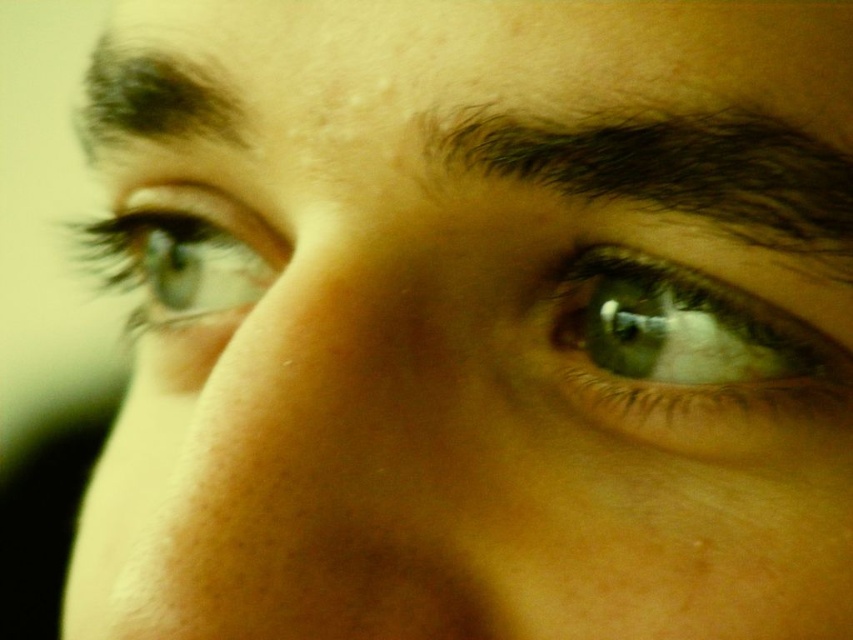
Question: Among these objects, which one is farthest from the camera?

Choices:
 (A) green matte eye at upper left
 (B) dark brown hair at upper left
 (C) dark brown hair at upper center

Answer: (A)

Question: Among these objects, which one is farthest from the camera?

Choices:
 (A) green matte eye at upper left
 (B) green matte eye at center
 (C) dark brown hair at upper center

Answer: (A)

Question: Is green matte eye at center positioned at the back of green matte eye at upper left?

Choices:
 (A) no
 (B) yes

Answer: (A)

Question: Can you confirm if green matte eye at center is bigger than green matte eye at upper left?

Choices:
 (A) yes
 (B) no

Answer: (B)

Question: Which object is closer to the camera taking this photo?

Choices:
 (A) green matte eye at upper left
 (B) dark brown hair at upper left
 (C) green matte eye at center
 (D) dark brown hair at upper center

Answer: (D)

Question: Is the position of dark brown hair at upper center more distant than that of dark brown hair at upper left?

Choices:
 (A) yes
 (B) no

Answer: (B)